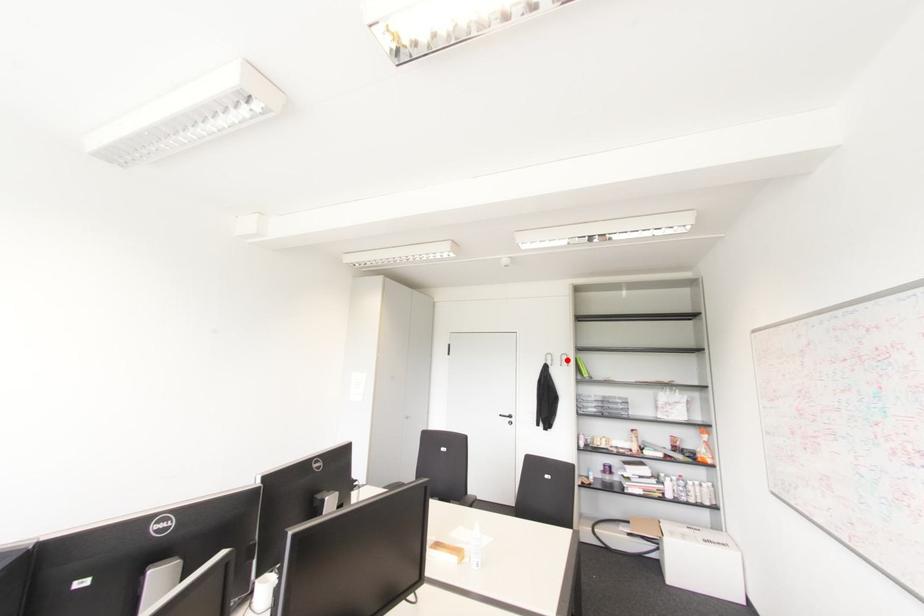
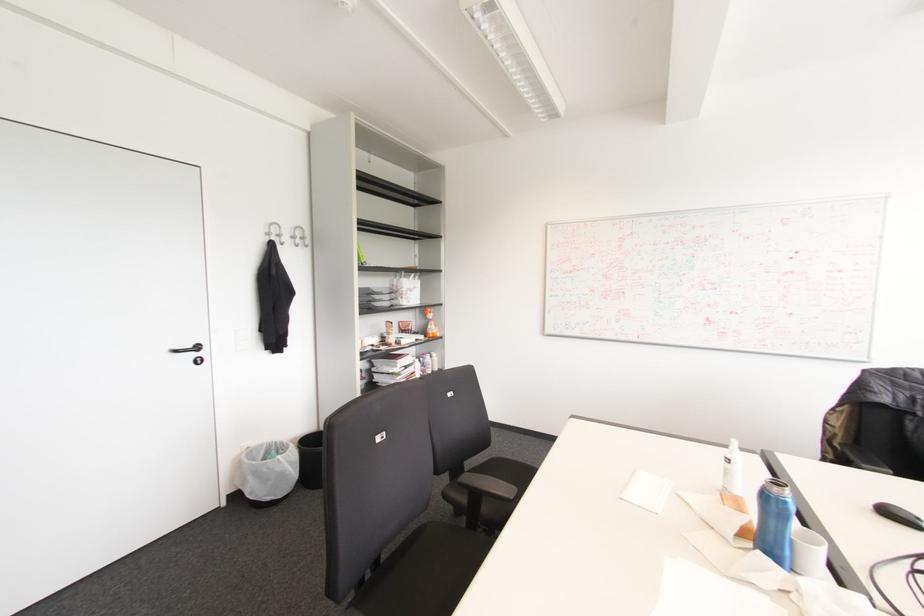
Find the pixel in the second image that matches the highlighted location in the first image.

(301, 238)